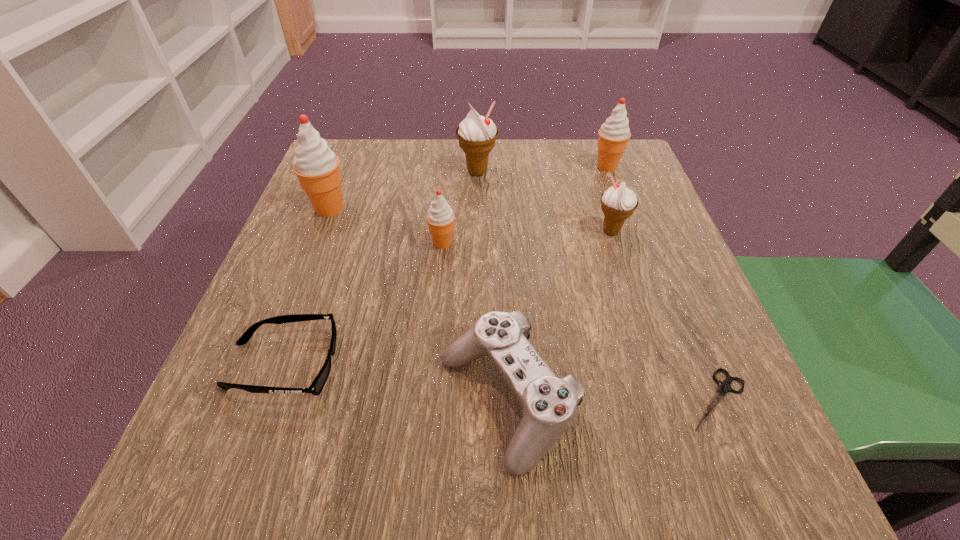
In order to click on the leftmost icecream in this screenshot , I will do click(x=317, y=167).

Identify the location of the tallest icecream. Image resolution: width=960 pixels, height=540 pixels. (317, 167).

This screenshot has height=540, width=960. In order to click on the farthest red icecream in this screenshot , I will do tap(614, 134).

This screenshot has height=540, width=960. I want to click on the second smallest red icecream, so click(614, 134).

Locate an element on the screen. the bigger white icecream is located at coordinates (476, 134).

At what (x,y) coordinates should I click in order to perform the action: click on the farther white icecream. Please return your answer as a coordinate pair (x, y). This screenshot has width=960, height=540. Looking at the image, I should click on pos(476,134).

Identify the location of the second red icecream from right to left. (440, 217).

You are a GUI agent. You are given a task and a screenshot of the screen. Output one action in this format:
    pyautogui.click(x=<x>, y=<y>)
    Task: Click on the smallest red icecream
    
    Given the screenshot: What is the action you would take?
    pyautogui.click(x=440, y=217)

Where is `the smaller white icecream`? Image resolution: width=960 pixels, height=540 pixels. the smaller white icecream is located at coordinates pyautogui.click(x=618, y=203).

You are a GUI agent. You are given a task and a screenshot of the screen. Output one action in this format:
    pyautogui.click(x=<x>, y=<y>)
    Task: Click on the nearer white icecream
    The height and width of the screenshot is (540, 960).
    Given the screenshot: What is the action you would take?
    pyautogui.click(x=618, y=203)